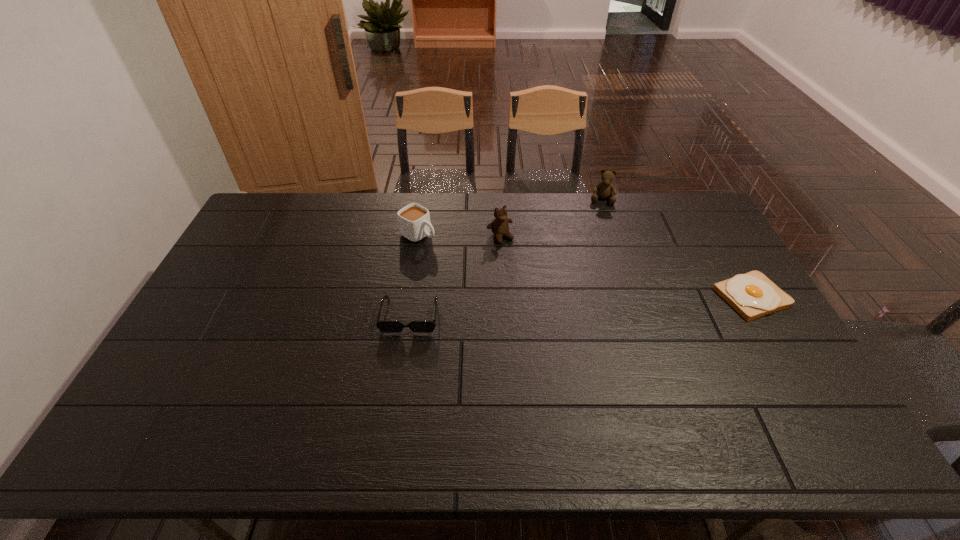
Locate an element on the screen. The image size is (960, 540). the second shortest object is located at coordinates (384, 326).

Image resolution: width=960 pixels, height=540 pixels. I want to click on toast, so click(x=753, y=295).

Image resolution: width=960 pixels, height=540 pixels. What are the coordinates of `the rightmost object` in the screenshot? It's located at point(753,295).

Find the location of a particular element. This screenshot has height=540, width=960. the nearer teddy bear is located at coordinates (499, 226).

The width and height of the screenshot is (960, 540). In order to click on the left teddy bear in this screenshot , I will do `click(499, 226)`.

This screenshot has height=540, width=960. I want to click on the farther teddy bear, so click(605, 189).

Find the location of a particular element. the farthest object is located at coordinates (605, 189).

Locate an element on the screen. Image resolution: width=960 pixels, height=540 pixels. the third tallest object is located at coordinates coord(414,223).

Locate an element on the screen. The image size is (960, 540). vacant space situated 0.060m on the front-facing side of the second shortest object is located at coordinates point(404,353).

Identify the location of free point located on the back of the toast. The height and width of the screenshot is (540, 960). 708,224.